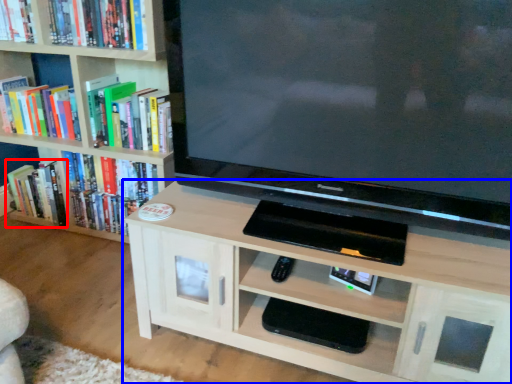
Question: Which object is closer to the camera taking this photo, book (highlighted by a red box) or shelf (highlighted by a blue box)?

Choices:
 (A) book
 (B) shelf

Answer: (B)